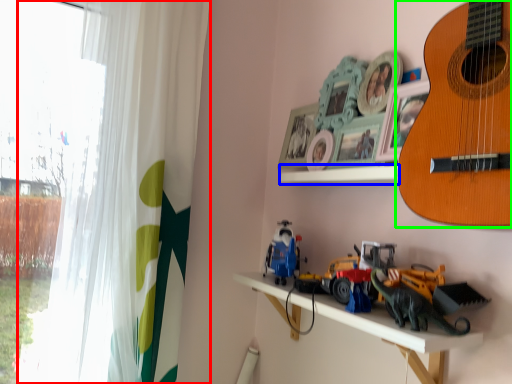
Question: Which is nearer to the curtain (highlighted by a red box)? window sill (highlighted by a blue box) or guitar (highlighted by a green box).

Choices:
 (A) window sill
 (B) guitar

Answer: (A)